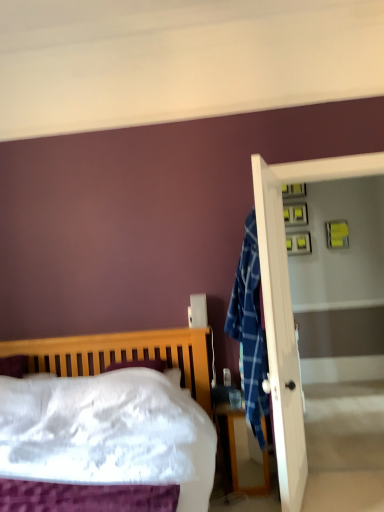
Question: Is wooden bed at left taller or shorter than wooden nightstand at lower right?

Choices:
 (A) short
 (B) tall

Answer: (B)

Question: From the image's perspective, is wooden bed at left located above or below wooden nightstand at lower right?

Choices:
 (A) below
 (B) above

Answer: (B)

Question: Estimate the real-world distances between objects in this image. Which object is farther from the wooden bed at left?

Choices:
 (A) wooden nightstand at lower right
 (B) white glossy screen door at right

Answer: (B)

Question: Based on their relative distances, which object is farther from the white glossy screen door at right?

Choices:
 (A) wooden bed at left
 (B) wooden nightstand at lower right

Answer: (A)